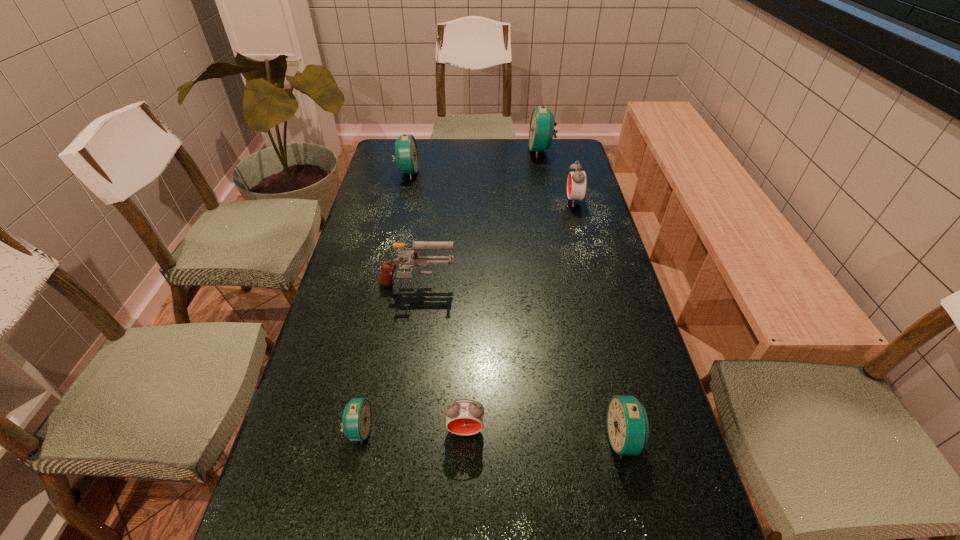
You are a GUI agent. You are given a task and a screenshot of the screen. Output one action in this format:
    pyautogui.click(x=<x>, y=<y>)
    Task: Click on the vacant space located 0.110m on the front-facing side of the third biggest blue alarm clock
    This screenshot has height=540, width=960.
    Given the screenshot: What is the action you would take?
    pyautogui.click(x=553, y=438)

Find the location of a particular element. The image size is (960, 540). vacant space located 0.280m on the front-facing side of the third biggest blue alarm clock is located at coordinates (470, 438).

Where is `vacant space located on the front-facing side of the third biggest blue alarm clock`? This screenshot has width=960, height=540. vacant space located on the front-facing side of the third biggest blue alarm clock is located at coordinates (524, 438).

Locate an element on the screen. free point located on the face of the nearer red alarm clock is located at coordinates (464, 491).

This screenshot has width=960, height=540. Find the location of `vacant point located on the front-facing side of the shortest object`. vacant point located on the front-facing side of the shortest object is located at coordinates (516, 430).

The height and width of the screenshot is (540, 960). I want to click on gun located in the left edge section of the desktop, so click(419, 259).

Find the location of `object that is at the far left corner`. object that is at the far left corner is located at coordinates (406, 155).

Identify the location of object at the far right corner. Image resolution: width=960 pixels, height=540 pixels. (541, 131).

At what (x,y) coordinates should I click in order to perform the action: click on vacant region at the far edge of the desktop. Please return your answer as a coordinate pair (x, y). This screenshot has height=540, width=960. Looking at the image, I should click on (502, 148).

Locate an element on the screen. The image size is (960, 540). free spot at the left edge of the desktop is located at coordinates (363, 260).